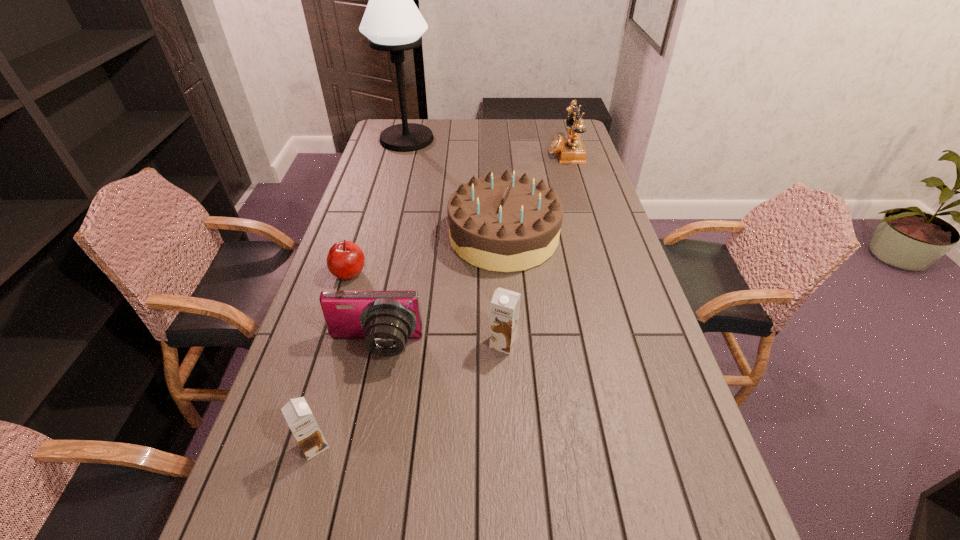
I want to click on table lamp located in the far edge section of the desktop, so click(x=392, y=22).

What are the coordinates of `telephone that is at the far edge` in the screenshot? It's located at (569, 151).

Image resolution: width=960 pixels, height=540 pixels. Find the location of `chocolate milk located at the left edge`. chocolate milk located at the left edge is located at coordinates coord(297,413).

This screenshot has height=540, width=960. What are the coordinates of `table lamp that is at the left edge` in the screenshot? It's located at (392, 22).

Image resolution: width=960 pixels, height=540 pixels. Find the location of `apple that is at the left edge`. apple that is at the left edge is located at coordinates (345, 260).

This screenshot has height=540, width=960. Find the location of `camera that is at the left edge`. camera that is at the left edge is located at coordinates (385, 319).

Where is `object that is at the right edge`? object that is at the right edge is located at coordinates (569, 151).

Where is `object situated at the far left corner`? The image size is (960, 540). object situated at the far left corner is located at coordinates (392, 22).

This screenshot has height=540, width=960. I want to click on object present at the far right corner, so [569, 151].

In order to click on free region at the far edge of the desktop in this screenshot , I will do `click(451, 121)`.